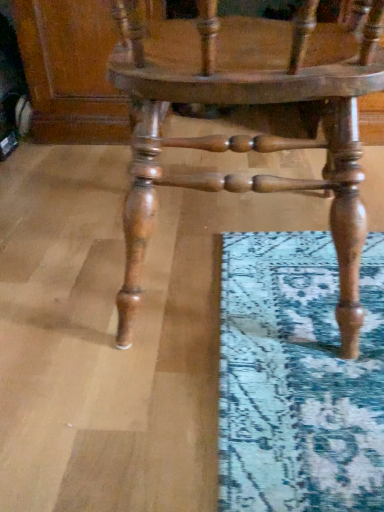
Describe the element at coordinates (249, 104) in the screenshot. I see `wooden chair leg at center` at that location.

What is the approximate height of wooden chair leg at center?

The height of wooden chair leg at center is 20.81 inches.

Find the location of a particular element. The height and width of the screenshot is (512, 384). wooden chair leg at center is located at coordinates (249, 104).

Locate an element on the screen. This screenshot has height=512, width=384. wooden chair leg at center is located at coordinates (249, 104).